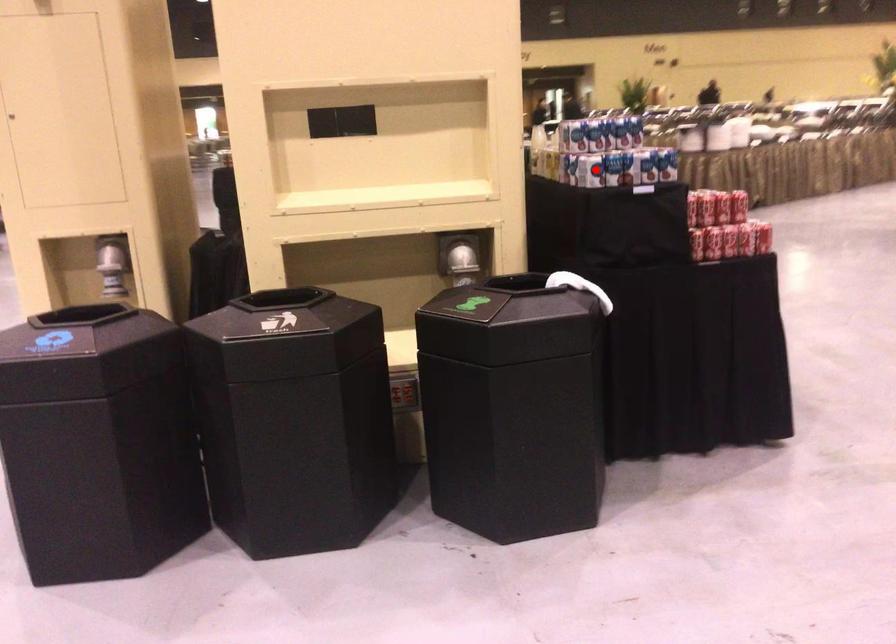
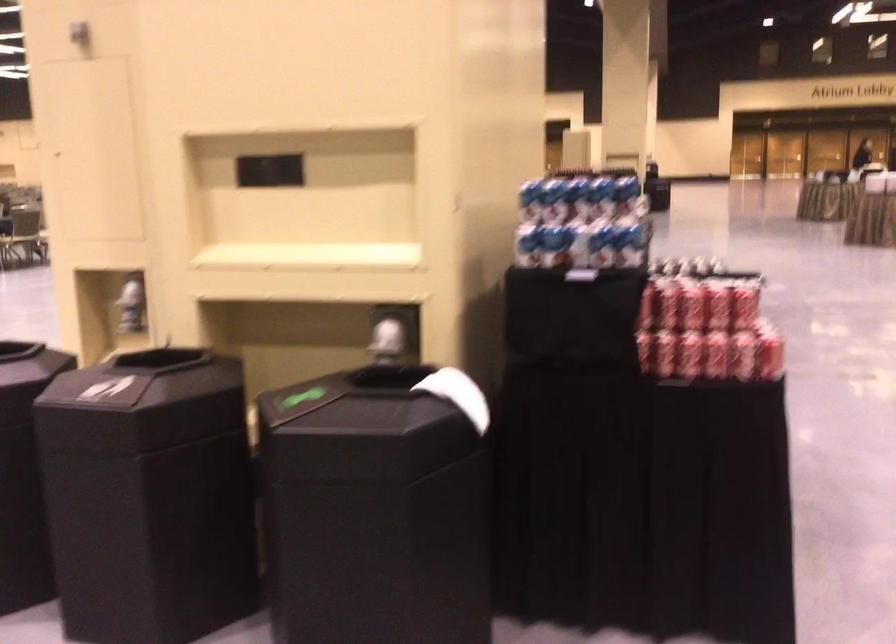
Question: I am providing you with two images of the same scene from different viewpoints. In image1, a red point is highlighted. Considering the same 3D point in image2, which of the following is correct?

Choices:
 (A) It is closer
 (B) It is farther

Answer: (A)